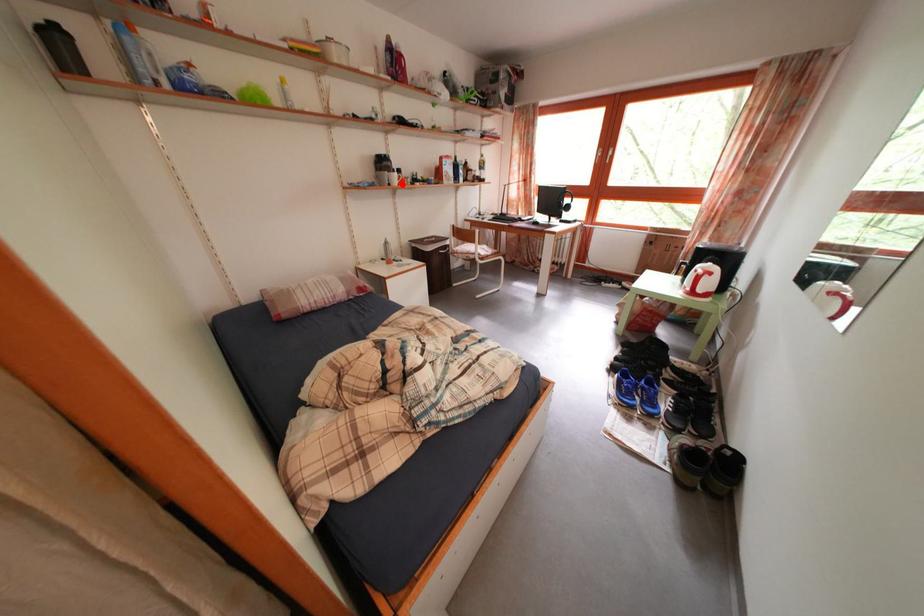
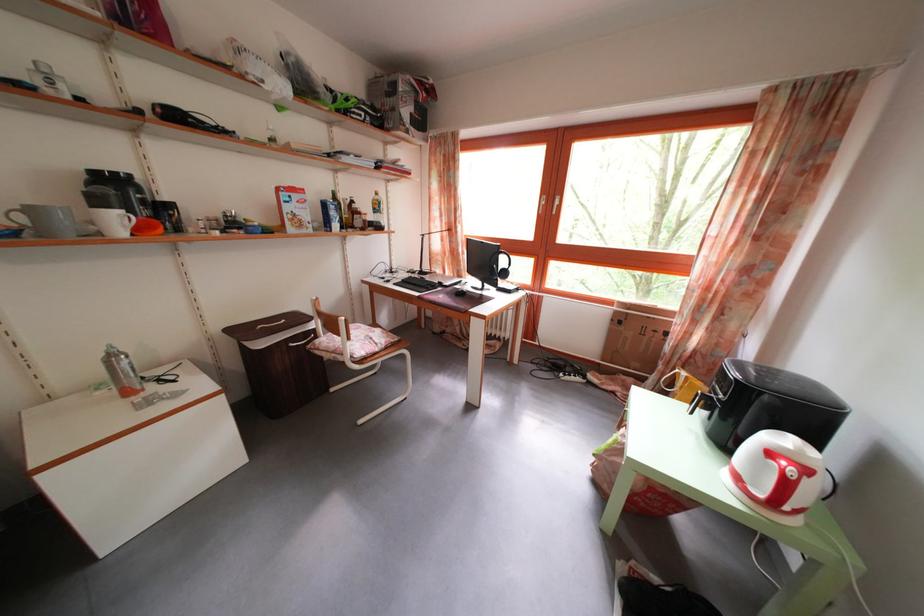
Question: I am providing you with two images of the same scene from different viewpoints. In image1, a red point is highlighted. Considering the same 3D point in image2, which of the following is correct?

Choices:
 (A) It is closer
 (B) It is farther

Answer: (B)